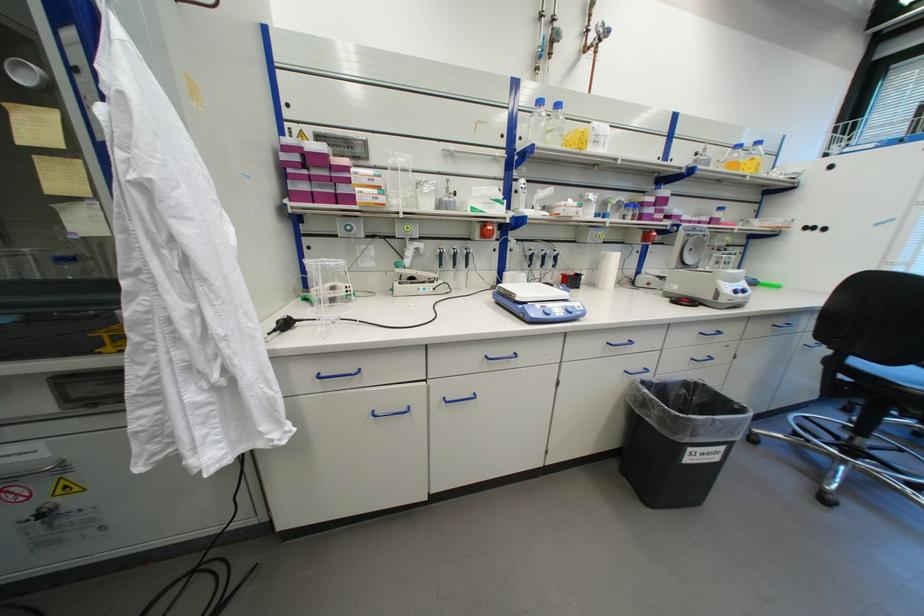
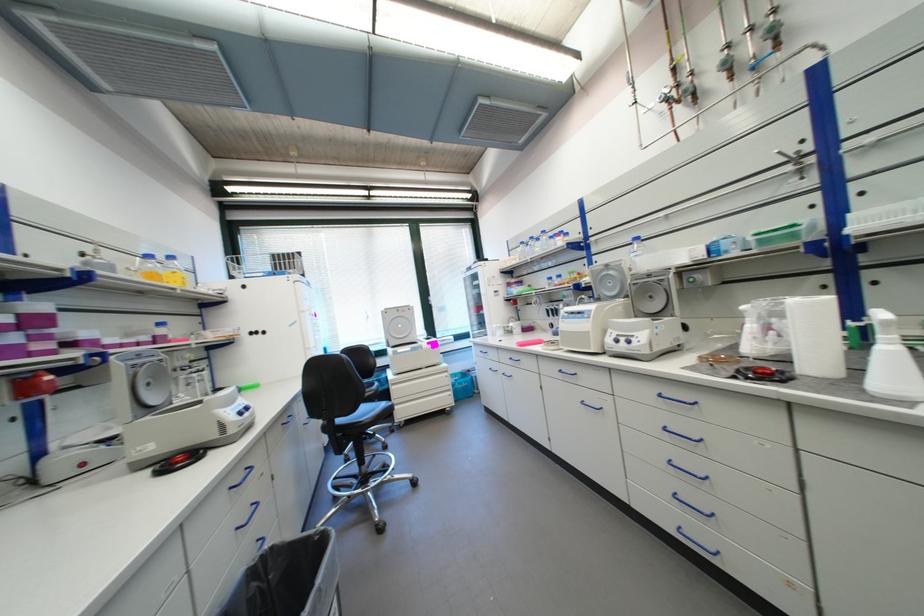
Question: The camera is either moving clockwise (left) or counter-clockwise (right) around the object. The first image is from the beginning of the video and the second image is from the end. Is the camera moving left or right when shooting the video?

Choices:
 (A) Left
 (B) Right

Answer: (A)